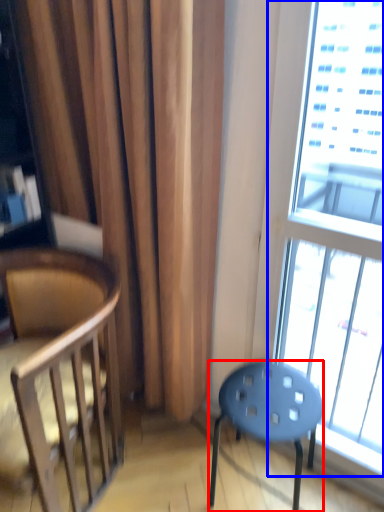
Question: Among these objects, which one is farthest to the camera, stool (highlighted by a red box) or window (highlighted by a blue box)?

Choices:
 (A) stool
 (B) window

Answer: (A)